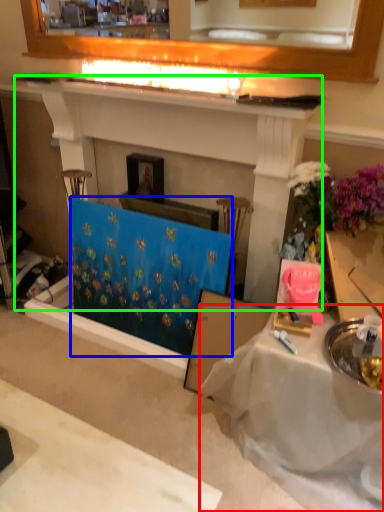
Question: Estimate the real-world distances between objects in this image. Which object is closer to table (highlighted by a red box), curtain (highlighted by a blue box) or fireplace (highlighted by a green box)?

Choices:
 (A) curtain
 (B) fireplace

Answer: (A)